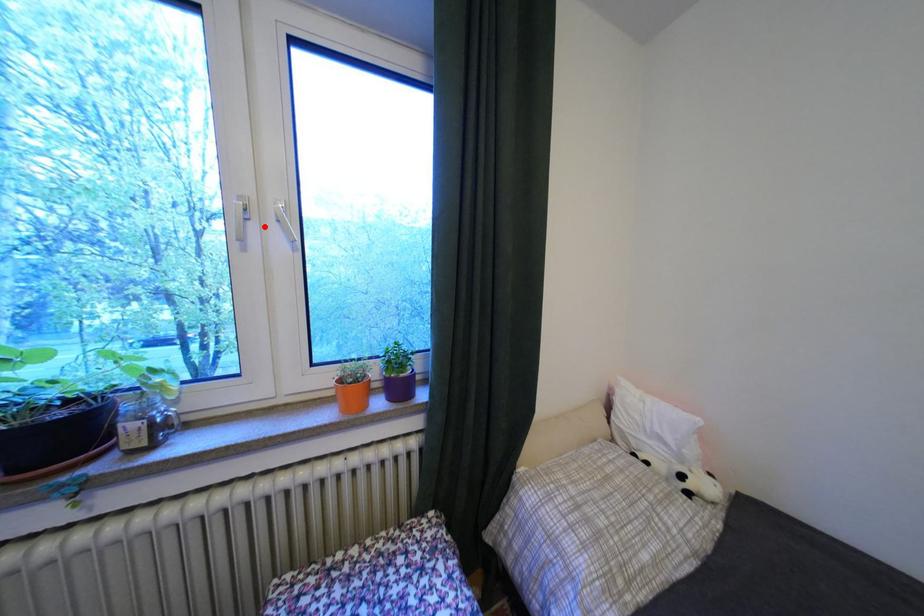
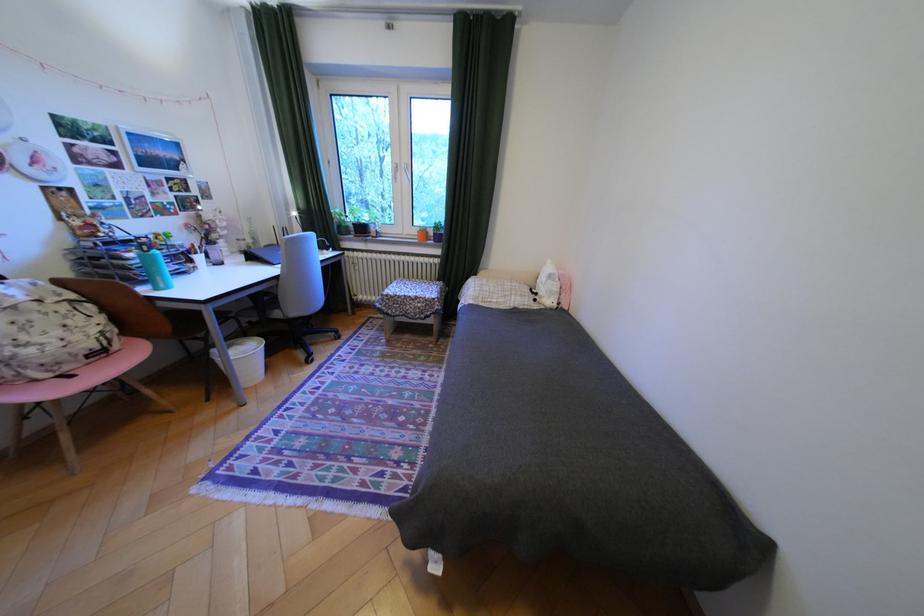
In the second image, find the point that corresponds to the highlighted location in the first image.

(410, 174)